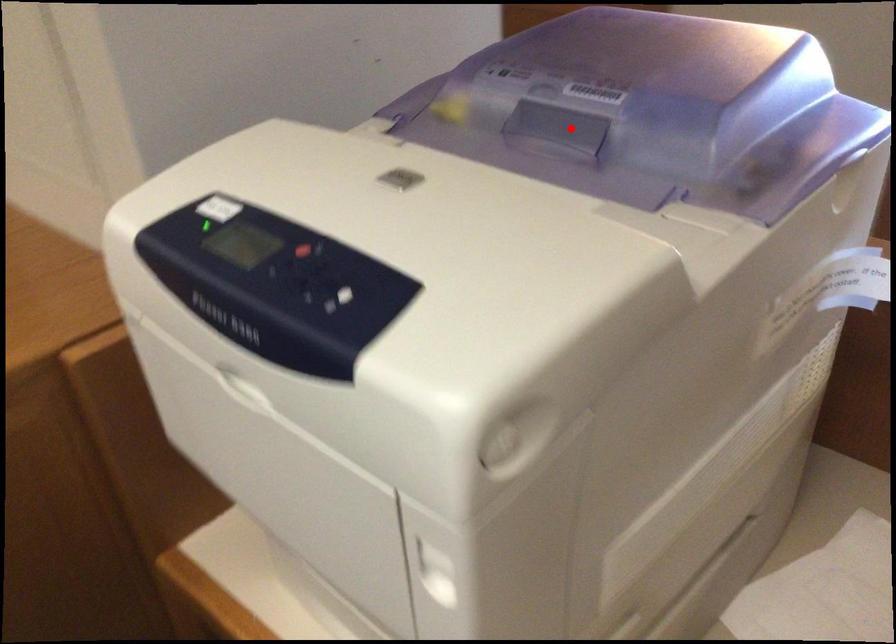
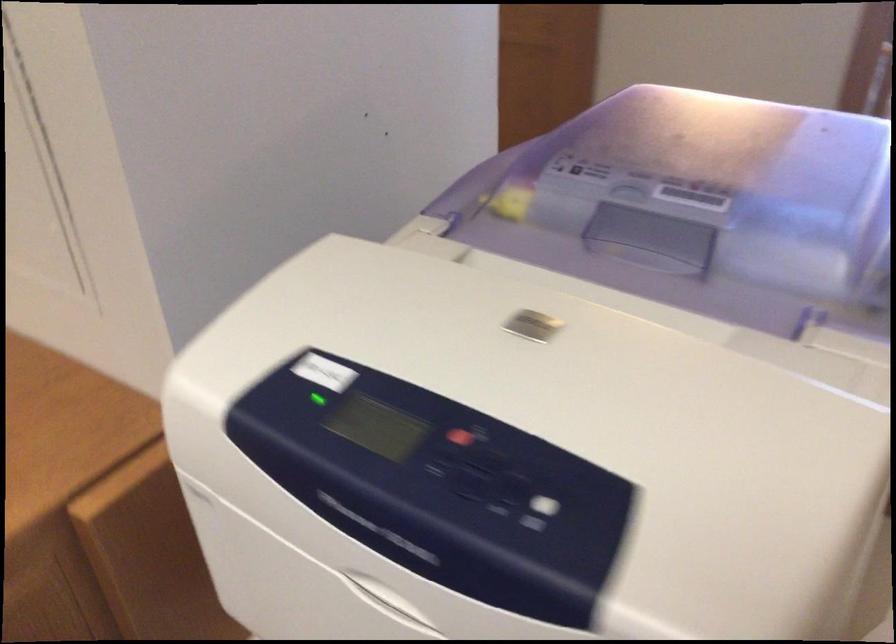
Where in the second image is the point corresponding to the highlighted location from the first image?

(656, 234)